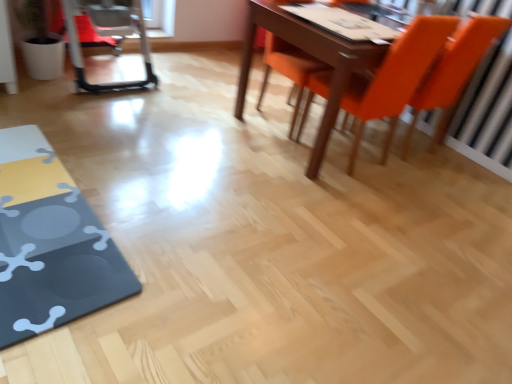
Find the location of a particular element. This screenshot has height=384, width=512. empty space that is to the right of orange matte chair at right, which is the third chair from left to right is located at coordinates (471, 167).